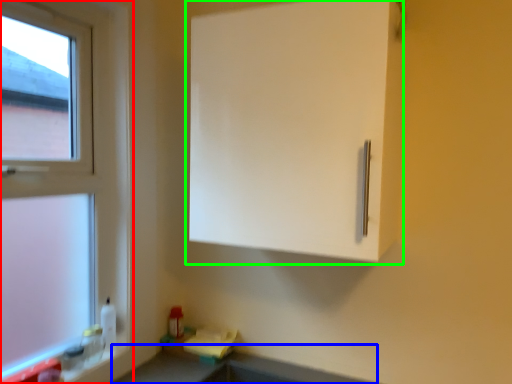
Question: Which object is the farthest from window (highlighted by a red box)? Choose among these: counter top (highlighted by a blue box) or cabinetry (highlighted by a green box).

Choices:
 (A) counter top
 (B) cabinetry

Answer: (A)